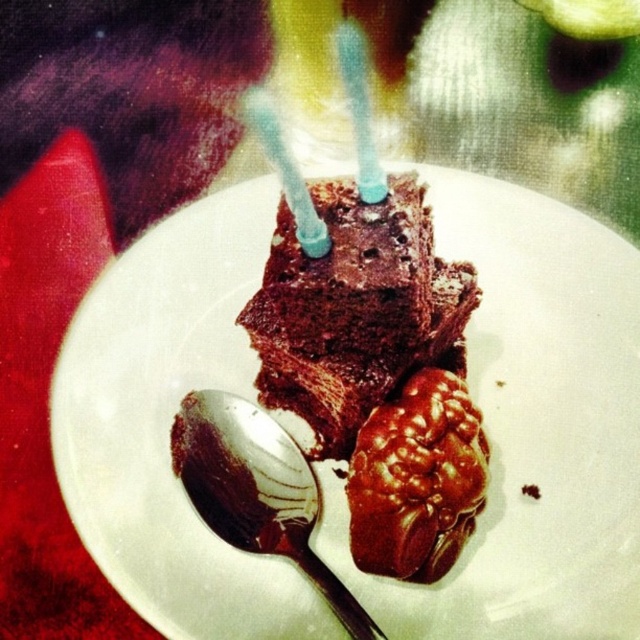
Question: Among these objects, which one is nearest to the camera?

Choices:
 (A) chocolate matte cake at center
 (B) chocolate cake at center
 (C) shiny chocolate candy at center
 (D) shiny silver spoon at lower left

Answer: (A)

Question: Can you confirm if chocolate matte cake at center is wider than translucent plastic candle at center?

Choices:
 (A) yes
 (B) no

Answer: (A)

Question: Does chocolate matte cake at center have a lesser width compared to translucent plastic candle at center?

Choices:
 (A) no
 (B) yes

Answer: (A)

Question: Can you confirm if chocolate matte cake at center is wider than translucent plastic candle at center?

Choices:
 (A) no
 (B) yes

Answer: (B)

Question: Which point is closer to the camera?

Choices:
 (A) (257, 113)
 (B) (604, 566)
 (C) (200, 502)

Answer: (B)

Question: Which point is farther to the camera?

Choices:
 (A) translucent plastic candle at center
 (B) chocolate cake at center
 (C) shiny silver spoon at lower left
 (D) shiny chocolate candy at center

Answer: (A)